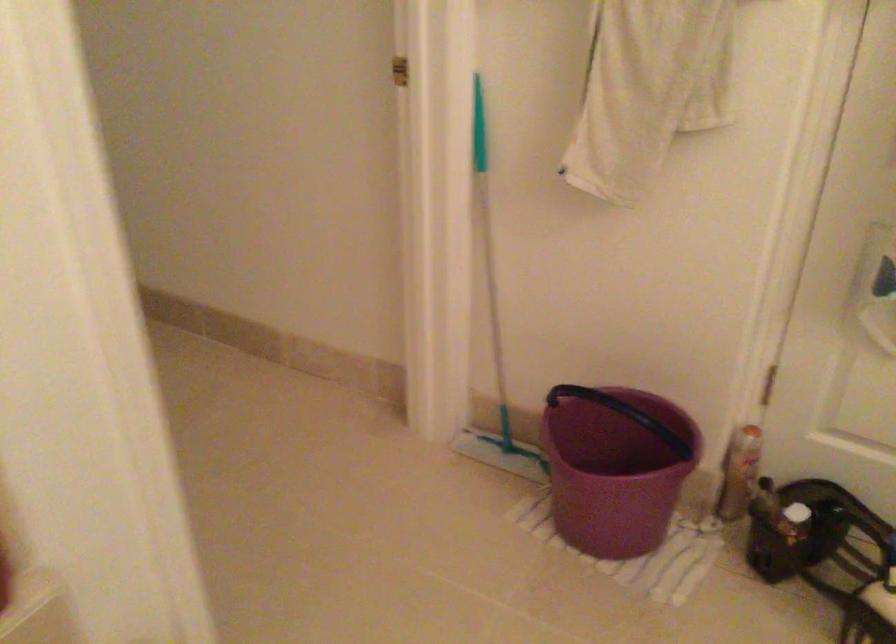
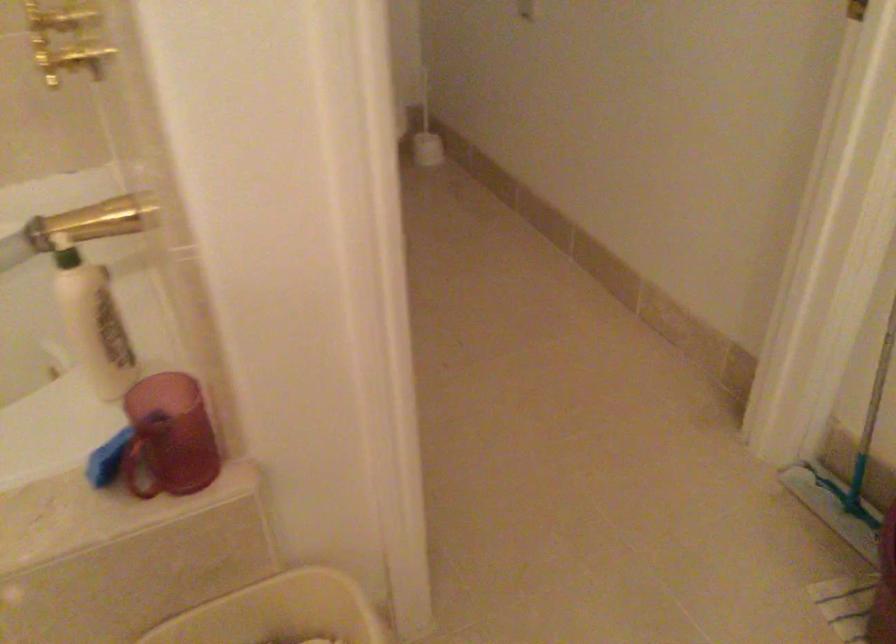
Where in the second image is the point corresponding to (501,384) from the first image?

(866, 431)